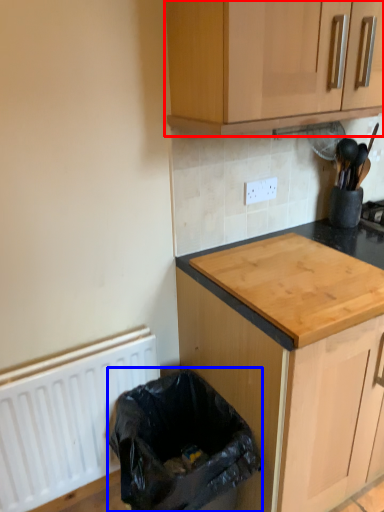
Question: Which object is further to the camera taking this photo, cabinetry (highlighted by a red box) or recycling bin (highlighted by a blue box)?

Choices:
 (A) cabinetry
 (B) recycling bin

Answer: (B)